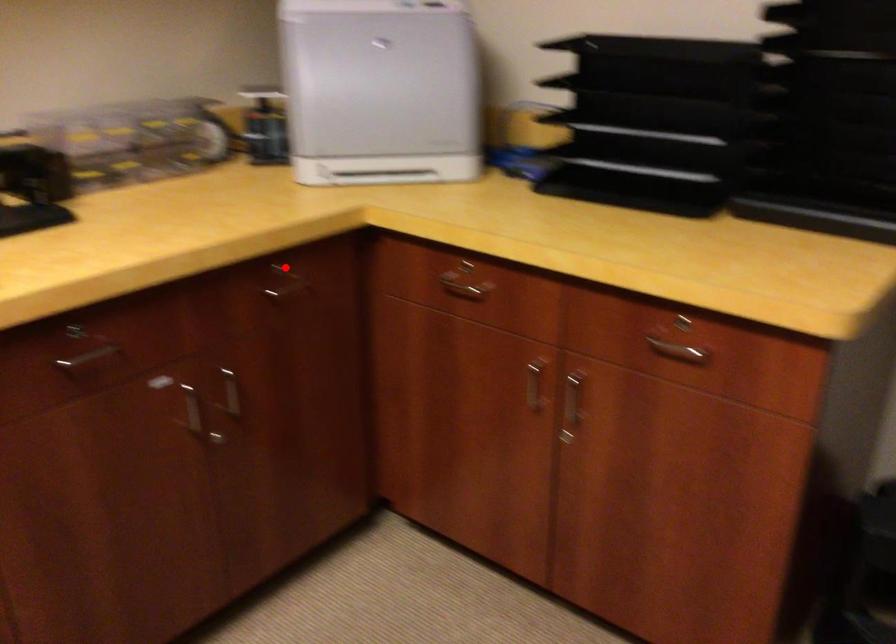
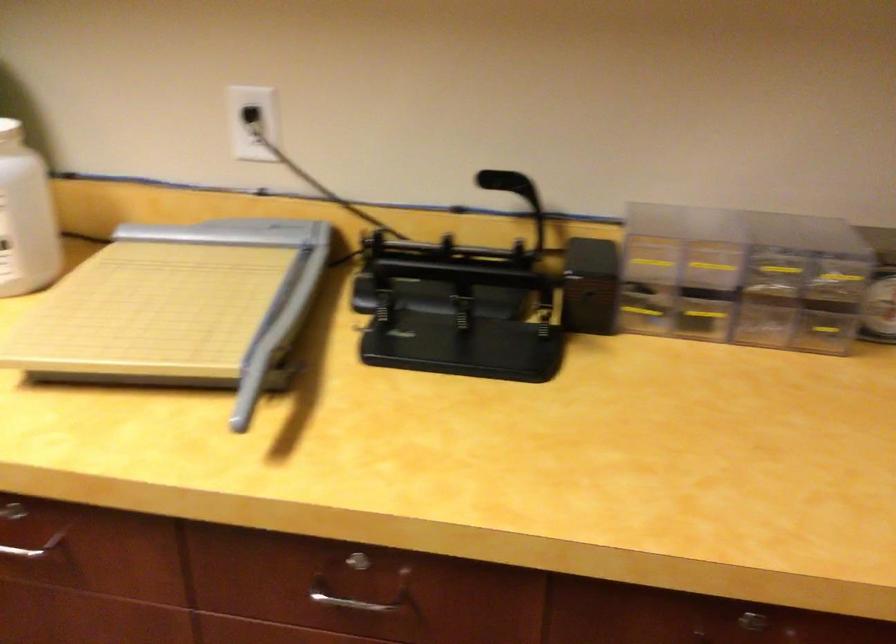
Question: I am providing you with two images of the same scene from different viewpoints. Given a red point in image1, look at the same physical point in image2. Is it:

Choices:
 (A) Closer to the viewpoint
 (B) Farther from the viewpoint

Answer: (A)